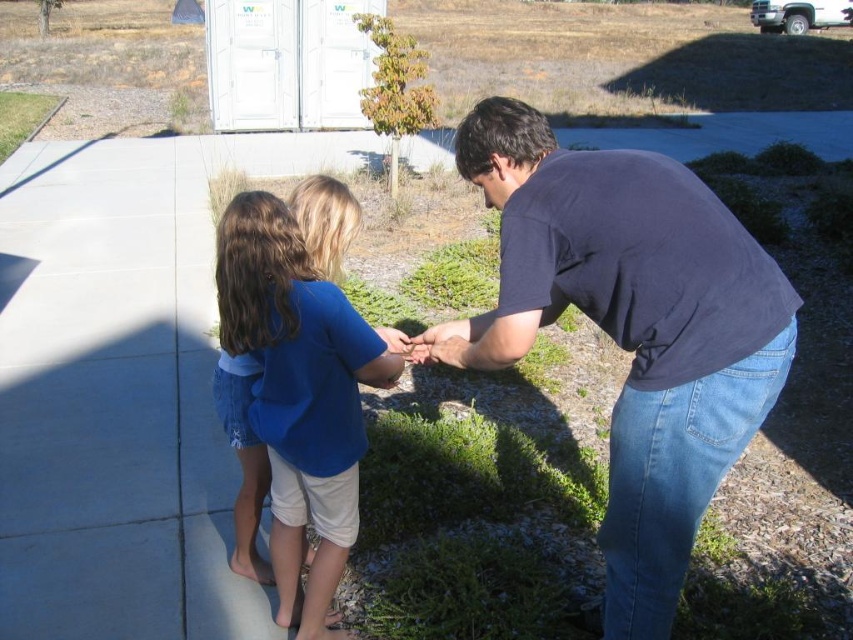
Between dark blue shirt at center and blue cotton shirt at center, which one has less height?

blue cotton shirt at center is shorter.

Does dark blue shirt at center have a smaller size compared to blue cotton shirt at center?

No, dark blue shirt at center is not smaller than blue cotton shirt at center.

Describe the element at coordinates (630, 328) in the screenshot. I see `dark blue shirt at center` at that location.

Identify the location of dark blue shirt at center. This screenshot has width=853, height=640. (630, 328).